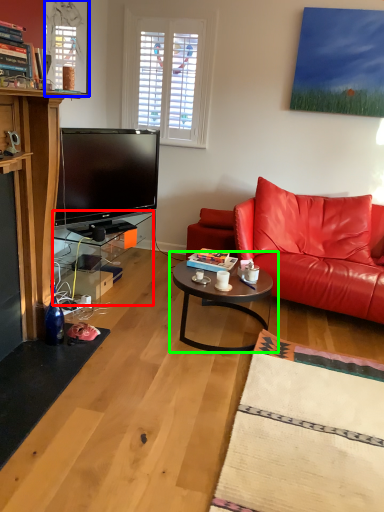
Question: Which object is positioned farthest from table (highlighted by a red box)? Select from window screen (highlighted by a blue box) and coffee table (highlighted by a green box).

Choices:
 (A) window screen
 (B) coffee table

Answer: (A)